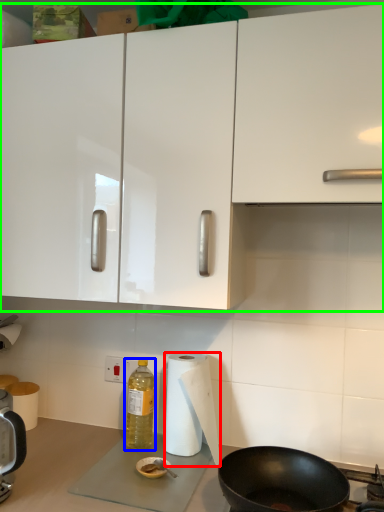
Question: Which object is positioned farthest from paper towel (highlighted by a red box)? Select from bottle (highlighted by a blue box) and cabinetry (highlighted by a green box).

Choices:
 (A) bottle
 (B) cabinetry

Answer: (B)